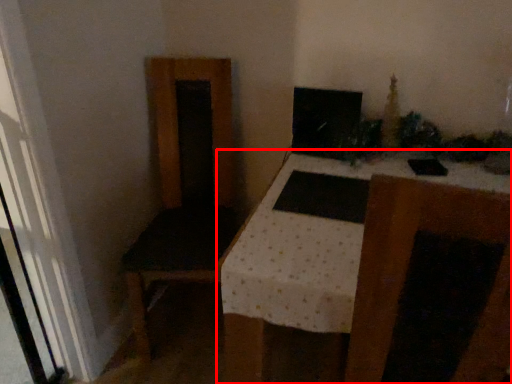
Question: From the image's perspective, where is table (annotated by the red box) located in relation to computer monitor in the image?

Choices:
 (A) below
 (B) above

Answer: (A)